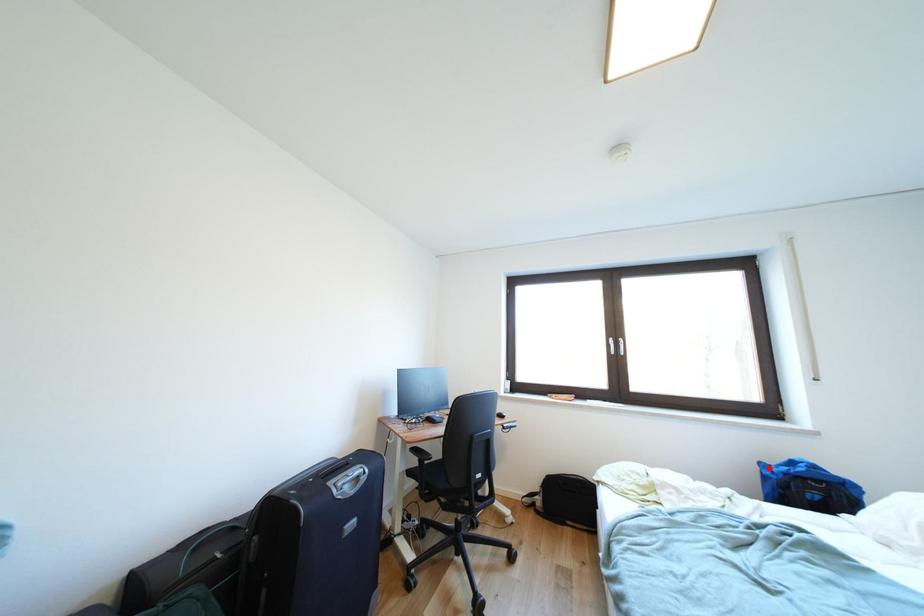
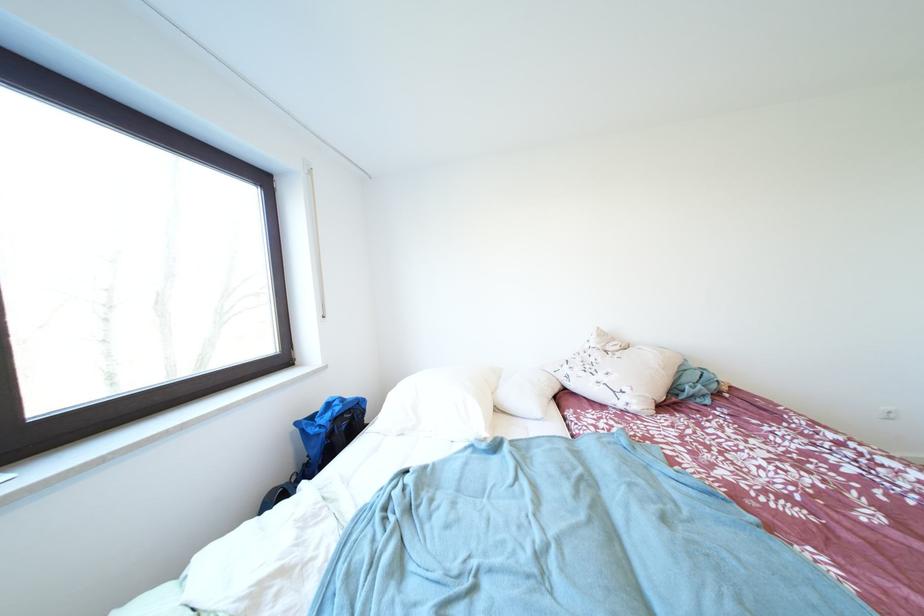
Question: I am providing you with two images of the same scene from different viewpoints. A red point is shown in image1. For the corresponding object point in image2, is it positioned nearer or farther from the camera?

Choices:
 (A) Nearer
 (B) Farther

Answer: (B)